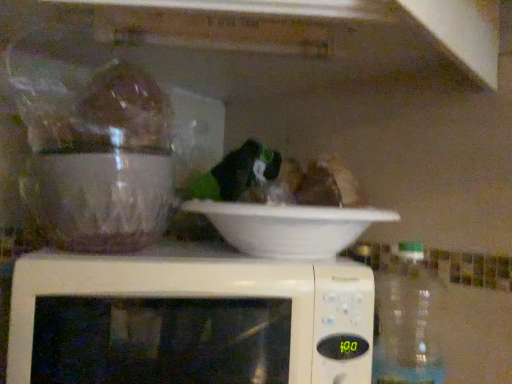
Where is `white matte bowl at center`? Image resolution: width=512 pixels, height=384 pixels. white matte bowl at center is located at coordinates (288, 227).

The image size is (512, 384). What do you see at coordinates (408, 320) in the screenshot? I see `transparent plastic bottle at right` at bounding box center [408, 320].

The image size is (512, 384). I want to click on white matte bowl at center, so click(288, 227).

Based on the photo, is white matte bowl at center positioned before white plastic microwave at center?

No, it is not.

From the image's perspective, which is above, white matte bowl at center or white plastic microwave at center?

white matte bowl at center appears higher in the image.

In the image, is white matte bowl at center on the left side or the right side of white plastic microwave at center?

white matte bowl at center is positioned on white plastic microwave at center's right side.

Which of these two, white matte bowl at center or white plastic microwave at center, stands shorter?

white matte bowl at center is shorter.

Is white plastic microwave at center not inside transparent plastic bottle at right?

Yes, white plastic microwave at center is outside of transparent plastic bottle at right.

How far apart are white plastic microwave at center and transparent plastic bottle at right?

8.00 inches.

Considering the relative sizes of white plastic microwave at center and transparent plastic bottle at right in the image provided, is white plastic microwave at center taller than transparent plastic bottle at right?

No.

Which is more to the right, white plastic microwave at center or transparent plastic bottle at right?

transparent plastic bottle at right.

Which is more to the right, transparent plastic bottle at right or white matte bowl at center?

transparent plastic bottle at right is more to the right.

Is point (389, 291) positioned in front of point (263, 247)?

No, (389, 291) is further to viewer.

Could you tell me if transparent plastic bottle at right is facing white matte bowl at center?

No, transparent plastic bottle at right does not turn towards white matte bowl at center.

How many degrees apart are the facing directions of transparent plastic bottle at right and white matte bowl at center?

2.44 degrees.

From the image's perspective, would you say transparent plastic bottle at right is positioned over white plastic microwave at center?

No.

In the scene shown: Between transparent plastic bottle at right and white plastic microwave at center, which one has smaller width?

Thinner between the two is transparent plastic bottle at right.

The height and width of the screenshot is (384, 512). What are the coordinates of `bottle that is below the white plastic microwave at center (from the image's perspective)` in the screenshot? It's located at (408, 320).

Looking at this image, is white plastic microwave at center not within white matte bowl at center?

Indeed, white plastic microwave at center is completely outside white matte bowl at center.

Considering the sizes of objects white plastic microwave at center and white matte bowl at center in the image provided, who is taller, white plastic microwave at center or white matte bowl at center?

Standing taller between the two is white plastic microwave at center.

Is white plastic microwave at center not close to white matte bowl at center?

That's not correct — white plastic microwave at center is a little close to white matte bowl at center.

Is point (350, 297) closer to viewer compared to point (244, 229)?

Yes.

Is transparent plastic bottle at right located within white matte bowl at center?

That's incorrect, transparent plastic bottle at right is not inside white matte bowl at center.

Looking at this image, from the image's perspective, who appears lower, white matte bowl at center or transparent plastic bottle at right?

transparent plastic bottle at right.

Considering the sizes of objects white matte bowl at center and transparent plastic bottle at right in the image provided, who is taller, white matte bowl at center or transparent plastic bottle at right?

transparent plastic bottle at right.

Identify the location of microwave oven in front of the white matte bowl at center. The image size is (512, 384). (208, 297).

Identify the location of bottle on the right of white plastic microwave at center. The height and width of the screenshot is (384, 512). (408, 320).

Which object lies further to the anchor point white matte bowl at center, white plastic microwave at center or transparent plastic bottle at right?

The object further to white matte bowl at center is transparent plastic bottle at right.

Based on their spatial positions, is transparent plastic bottle at right or white plastic microwave at center further from white matte bowl at center?

Based on the image, transparent plastic bottle at right appears to be further to white matte bowl at center.

Looking at the image, which one is located closer to white plastic microwave at center, transparent plastic bottle at right or white matte bowl at center?

white matte bowl at center.

Looking at the image, which one is located further to transparent plastic bottle at right, white plastic microwave at center or white matte bowl at center?

white plastic microwave at center is positioned further to the anchor transparent plastic bottle at right.

When comparing their distances from white plastic microwave at center, does white matte bowl at center or transparent plastic bottle at right seem closer?

white matte bowl at center lies closer to white plastic microwave at center than the other object.

Looking at the image, which one is located further to transparent plastic bottle at right, white matte bowl at center or white plastic microwave at center?

white plastic microwave at center lies further to transparent plastic bottle at right than the other object.

Locate an element on the screen. Image resolution: width=512 pixels, height=384 pixels. bowl between white plastic microwave at center and transparent plastic bottle at right from left to right is located at coordinates (288, 227).